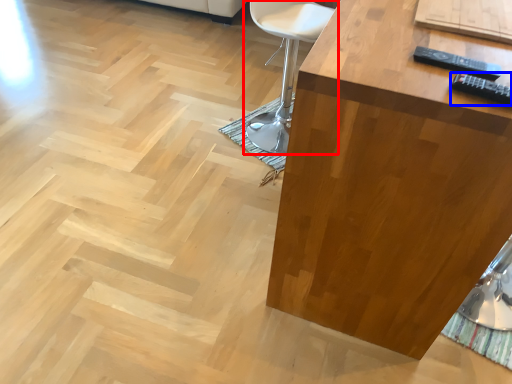
Question: Which object appears farthest to the camera in this image, chair (highlighted by a red box) or remote (highlighted by a blue box)?

Choices:
 (A) chair
 (B) remote

Answer: (A)